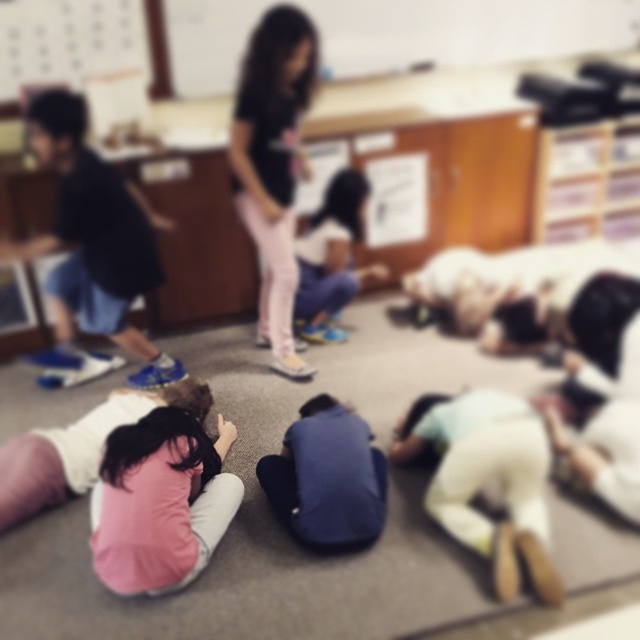
Question: Which object appears farthest from the camera in this image?

Choices:
 (A) white matte shirt at lower right
 (B) blue athletic shoes at left
 (C) matte black shirt at center
 (D) pink fabric shirt at lower left

Answer: (C)

Question: Is blue athletic shoes at left wider than white matte shirt at lower right?

Choices:
 (A) no
 (B) yes

Answer: (B)

Question: Which point is closer to the camera?

Choices:
 (A) (74, 227)
 (B) (276, 512)
 (C) (545, 518)

Answer: (C)

Question: Where is blue athletic shoes at left located in relation to blue fabric at center in the image?

Choices:
 (A) right
 (B) left

Answer: (B)

Question: Which object is farther from the camera taking this photo?

Choices:
 (A) blue fabric at center
 (B) matte black shirt at center
 (C) white matte shirt at lower right
 (D) blue athletic shoes at left

Answer: (B)

Question: Is white matte shirt at lower right below blue fabric at center?

Choices:
 (A) no
 (B) yes

Answer: (B)